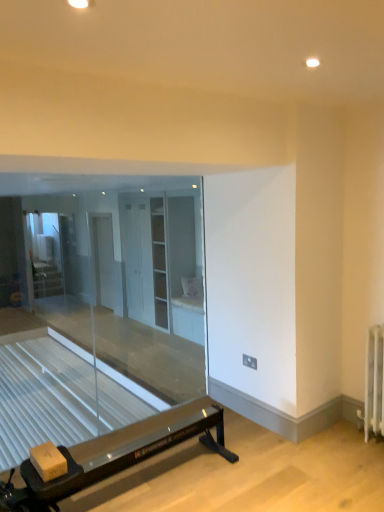
What do you see at coordinates (145, 260) in the screenshot?
I see `white glossy cabinet at center, placed as the first screen door when sorted from right to left` at bounding box center [145, 260].

The height and width of the screenshot is (512, 384). Describe the element at coordinates (102, 260) in the screenshot. I see `white glossy screen door at center, the 1th screen door in the back-to-front sequence` at that location.

The width and height of the screenshot is (384, 512). What are the coordinates of `black rubber exercise machine at lower left` in the screenshot? It's located at (110, 463).

In terms of height, does white glossy cabinet at center, which is the 2th screen door in left-to-right order, look taller or shorter compared to transparent glass door at left?

white glossy cabinet at center, which is the 2th screen door in left-to-right order, is taller than transparent glass door at left.

From the image's perspective, between white glossy cabinet at center, marked as the 1th screen door in a front-to-back arrangement, and transparent glass door at left, who is located below?

white glossy cabinet at center, marked as the 1th screen door in a front-to-back arrangement, appears lower in the image.

Is point (158, 245) farther from camera compared to point (61, 283)?

No, it is not.

Is white glossy screen door at center, the 2th screen door positioned from the front, aimed at transparent glass door at left?

No, white glossy screen door at center, the 2th screen door positioned from the front, is not turned towards transparent glass door at left.

The width and height of the screenshot is (384, 512). I want to click on glass door on the left side of white glossy screen door at center, placed as the 1th screen door when sorted from left to right, so click(x=47, y=255).

Considering the relative sizes of white glossy screen door at center, placed as the 1th screen door when sorted from left to right, and transparent glass door at left in the image provided, is white glossy screen door at center, placed as the 1th screen door when sorted from left to right, smaller than transparent glass door at left?

No, white glossy screen door at center, placed as the 1th screen door when sorted from left to right, is not smaller than transparent glass door at left.

Is point (98, 256) closer or farther from the camera than point (27, 215)?

Point (98, 256) appears to be farther away from the viewer than point (27, 215).

How many degrees apart are the facing directions of white glossy screen door at center, the 2th screen door positioned from the front, and black rubber exercise machine at lower left?

The angular difference between white glossy screen door at center, the 2th screen door positioned from the front, and black rubber exercise machine at lower left is 180 degrees.

From a real-world perspective, is white glossy screen door at center, the 1th screen door in the back-to-front sequence, on black rubber exercise machine at lower left?

Indeed, from a real-world perspective, white glossy screen door at center, the 1th screen door in the back-to-front sequence, stands above black rubber exercise machine at lower left.

Would you say white glossy screen door at center, the 2th screen door positioned from the front, is outside black rubber exercise machine at lower left?

Yes.

From the image's perspective, between white glossy screen door at center, the 2th screen door positioned from the front, and black rubber exercise machine at lower left, who is located below?

black rubber exercise machine at lower left.

From a real-world perspective, is black rubber exercise machine at lower left beneath white glossy screen door at center, placed as the 1th screen door when sorted from left to right?

Yes, from a real-world perspective, black rubber exercise machine at lower left is under white glossy screen door at center, placed as the 1th screen door when sorted from left to right.

Relative to white glossy screen door at center, the 1th screen door in the back-to-front sequence, is black rubber exercise machine at lower left in front or behind?

In the image, black rubber exercise machine at lower left appears in front of white glossy screen door at center, the 1th screen door in the back-to-front sequence.

Which is more to the right, black rubber exercise machine at lower left or white glossy screen door at center, the second screen door in the right-to-left sequence?

black rubber exercise machine at lower left is more to the right.

Is black rubber exercise machine at lower left inside or outside of white glossy screen door at center, the 2th screen door positioned from the front?

black rubber exercise machine at lower left is outside white glossy screen door at center, the 2th screen door positioned from the front.

Which of these two, transparent glass door at left or white glossy cabinet at center, placed as the first screen door when sorted from right to left, is smaller?

transparent glass door at left.

From a real-world perspective, is transparent glass door at left positioned above or below white glossy cabinet at center, which is the 2th screen door in left-to-right order?

transparent glass door at left is situated higher than white glossy cabinet at center, which is the 2th screen door in left-to-right order, in the real world.

You are a GUI agent. You are given a task and a screenshot of the screen. Output one action in this format:
    pyautogui.click(x=<x>, y=<y>)
    Task: Click on the 2nd screen door in front when counting from the transparent glass door at left
    This screenshot has height=512, width=384.
    Given the screenshot: What is the action you would take?
    pyautogui.click(x=145, y=260)

Does point (43, 273) lie in front of point (160, 232)?

No.

Is transparent glass door at left to the left of black rubber exercise machine at lower left from the viewer's perspective?

Yes.

Which object is more forward, transparent glass door at left or black rubber exercise machine at lower left?

black rubber exercise machine at lower left is closer to the camera.

Is transparent glass door at left in contact with black rubber exercise machine at lower left?

transparent glass door at left and black rubber exercise machine at lower left are not in contact.

From a real-world perspective, is transparent glass door at left physically above black rubber exercise machine at lower left?

Yes, from a real-world perspective, transparent glass door at left is over black rubber exercise machine at lower left

From a real-world perspective, is white glossy screen door at center, the 2th screen door positioned from the front, physically below white glossy cabinet at center, placed as the first screen door when sorted from right to left?

Indeed, from a real-world perspective, white glossy screen door at center, the 2th screen door positioned from the front, is positioned beneath white glossy cabinet at center, placed as the first screen door when sorted from right to left.

Is white glossy screen door at center, the 1th screen door in the back-to-front sequence, in contact with white glossy cabinet at center, which is the 2th screen door in left-to-right order?

No.

Considering the relative positions of white glossy screen door at center, placed as the 1th screen door when sorted from left to right, and white glossy cabinet at center, positioned as the 2th screen door in back-to-front order, in the image provided, is white glossy screen door at center, placed as the 1th screen door when sorted from left to right, behind white glossy cabinet at center, positioned as the 2th screen door in back-to-front order,?

Yes, the depth of white glossy screen door at center, placed as the 1th screen door when sorted from left to right, is greater than that of white glossy cabinet at center, positioned as the 2th screen door in back-to-front order.

Is white glossy screen door at center, the second screen door in the right-to-left sequence, completely or partially outside of white glossy cabinet at center, positioned as the 2th screen door in back-to-front order?

Indeed, white glossy screen door at center, the second screen door in the right-to-left sequence, is completely outside white glossy cabinet at center, positioned as the 2th screen door in back-to-front order.

Find the location of `the 1st screen door below the transparent glass door at left (from the image's perspective)`. the 1st screen door below the transparent glass door at left (from the image's perspective) is located at coordinates (145, 260).

Which screen door is the 1st one when counting from the front of the transparent glass door at left? Please provide its 2D coordinates.

[(102, 260)]

Based on the photo, estimate the real-world distances between objects in this image. Which object is closer to white glossy cabinet at center, positioned as the 2th screen door in back-to-front order, black rubber exercise machine at lower left or white glossy screen door at center, the 2th screen door positioned from the front?

Based on the image, white glossy screen door at center, the 2th screen door positioned from the front, appears to be nearer to white glossy cabinet at center, positioned as the 2th screen door in back-to-front order.

Estimate the real-world distances between objects in this image. Which object is further from white glossy screen door at center, the 1th screen door in the back-to-front sequence, black rubber exercise machine at lower left or white glossy cabinet at center, placed as the first screen door when sorted from right to left?

black rubber exercise machine at lower left is further to white glossy screen door at center, the 1th screen door in the back-to-front sequence.

Which object lies nearer to the anchor point white glossy screen door at center, the second screen door in the right-to-left sequence, white glossy cabinet at center, positioned as the 2th screen door in back-to-front order, or black rubber exercise machine at lower left?

The object closer to white glossy screen door at center, the second screen door in the right-to-left sequence, is white glossy cabinet at center, positioned as the 2th screen door in back-to-front order.

Based on their spatial positions, is white glossy cabinet at center, placed as the first screen door when sorted from right to left, or black rubber exercise machine at lower left closer to transparent glass door at left?

white glossy cabinet at center, placed as the first screen door when sorted from right to left, is closer to transparent glass door at left.

Considering their positions, is white glossy cabinet at center, marked as the 1th screen door in a front-to-back arrangement, positioned further to transparent glass door at left than white glossy screen door at center, the 1th screen door in the back-to-front sequence?

Among the two, white glossy cabinet at center, marked as the 1th screen door in a front-to-back arrangement, is located further to transparent glass door at left.

Looking at this image, based on their spatial positions, is black rubber exercise machine at lower left or white glossy screen door at center, placed as the 1th screen door when sorted from left to right, closer to transparent glass door at left?

white glossy screen door at center, placed as the 1th screen door when sorted from left to right, is closer to transparent glass door at left.

Based on their spatial positions, is transparent glass door at left or black rubber exercise machine at lower left closer to white glossy screen door at center, the 2th screen door positioned from the front?

Based on the image, transparent glass door at left appears to be nearer to white glossy screen door at center, the 2th screen door positioned from the front.

Considering their positions, is transparent glass door at left positioned closer to black rubber exercise machine at lower left than white glossy cabinet at center, placed as the first screen door when sorted from right to left?

white glossy cabinet at center, placed as the first screen door when sorted from right to left, lies closer to black rubber exercise machine at lower left than the other object.

The image size is (384, 512). Identify the location of screen door between transparent glass door at left and white glossy cabinet at center, marked as the 1th screen door in a front-to-back arrangement. (102, 260).

This screenshot has width=384, height=512. I want to click on screen door between black rubber exercise machine at lower left and white glossy screen door at center, placed as the 1th screen door when sorted from left to right, along the z-axis, so click(145, 260).